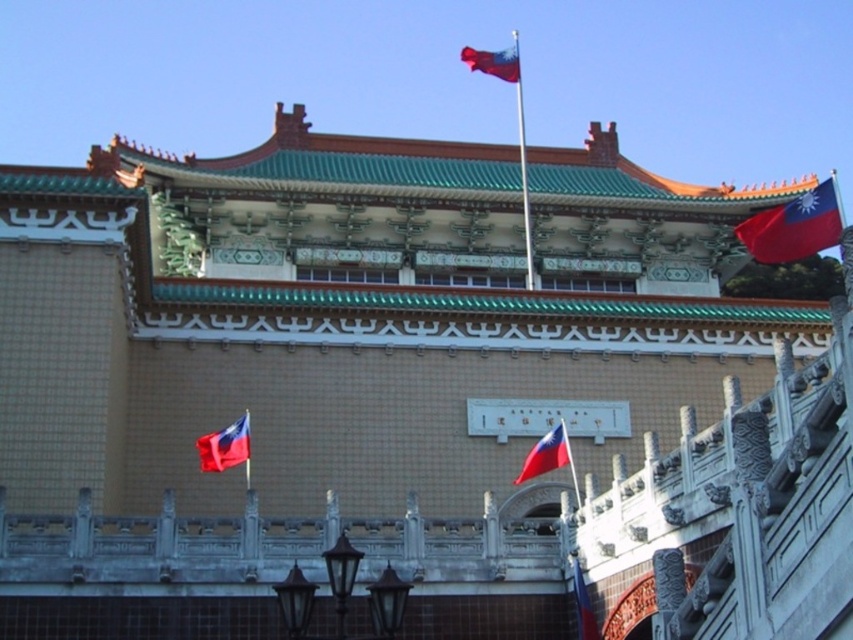
You are standing 100 meters away from the traditional building. There is a point marked at coordinates point (798, 212) on the building. Can you reach this point by walking straight towards the building without moving sideways?

The point marked at coordinates point (798, 212) is 77.32 meters from the viewer. Since you are standing 100 meters away, you can reach this point by walking straight towards the building without moving sideways because the distance is less than your current distance.

You are a photographer standing in front of the traditional building. You want to capture a photo that includes both the red fabric flag at upper right and the red fabric flag at center. Which flag should you position closer to the left side of your camera frame?

You should position the red fabric flag at center closer to the left side of your camera frame because the red fabric flag at upper right is to the right of it.